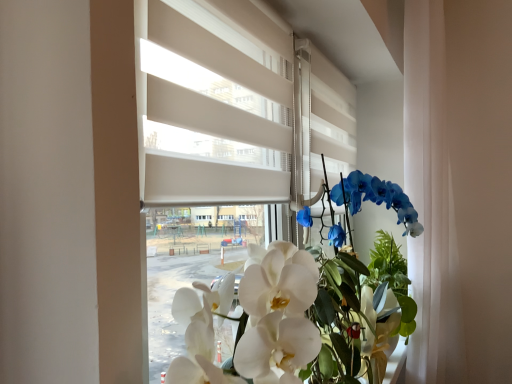
Question: Is point (426, 266) positioned closer to the camera than point (246, 119)?

Choices:
 (A) closer
 (B) farther

Answer: (B)

Question: Is white sheer curtain at right in front of or behind white matte blinds at center in the image?

Choices:
 (A) behind
 (B) front

Answer: (A)

Question: Considering the real-world distances, which object is farthest from the white matte blinds at center?

Choices:
 (A) white sheer curtain at right
 (B) white glossy orchid at center

Answer: (A)

Question: Estimate the real-world distances between objects in this image. Which object is closer to the white sheer curtain at right?

Choices:
 (A) white matte blinds at center
 (B) white glossy orchid at center

Answer: (B)